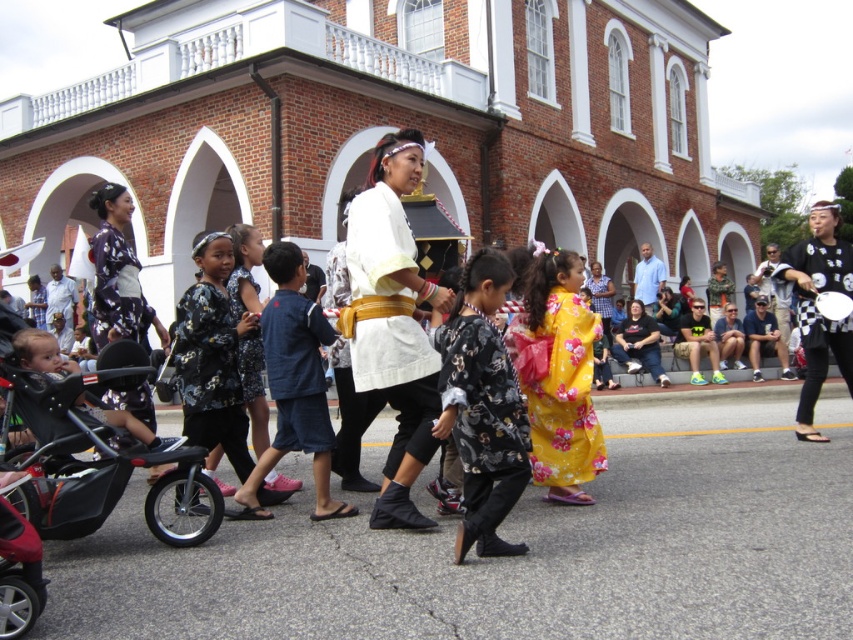
You are a photographer standing in front of the historic brick building and you see the white matte kimono at center and the black floral kimono at center. Which kimono is located to the left of the other?

The white matte kimono at center is positioned on the left side of the black floral kimono at center.